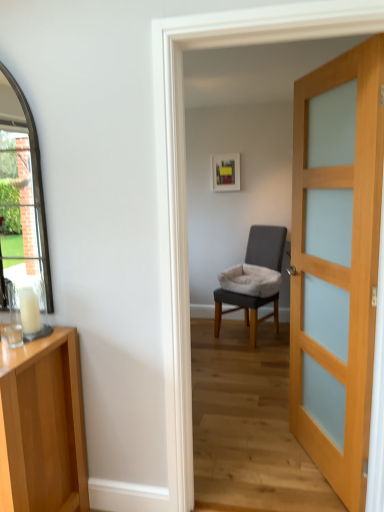
Find the location of a particular element. This screenshot has width=384, height=512. free space behind wooden door at right is located at coordinates (265, 424).